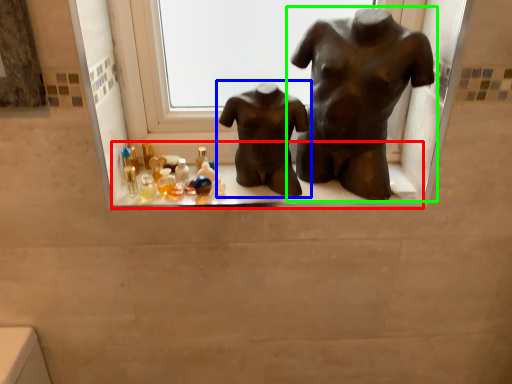
Question: Which is farther away from window sill (highlighted by a red box)? statue (sculpture) (highlighted by a blue box) or statue (sculpture) (highlighted by a green box)?

Choices:
 (A) statue (sculpture)
 (B) statue (sculpture)

Answer: (B)